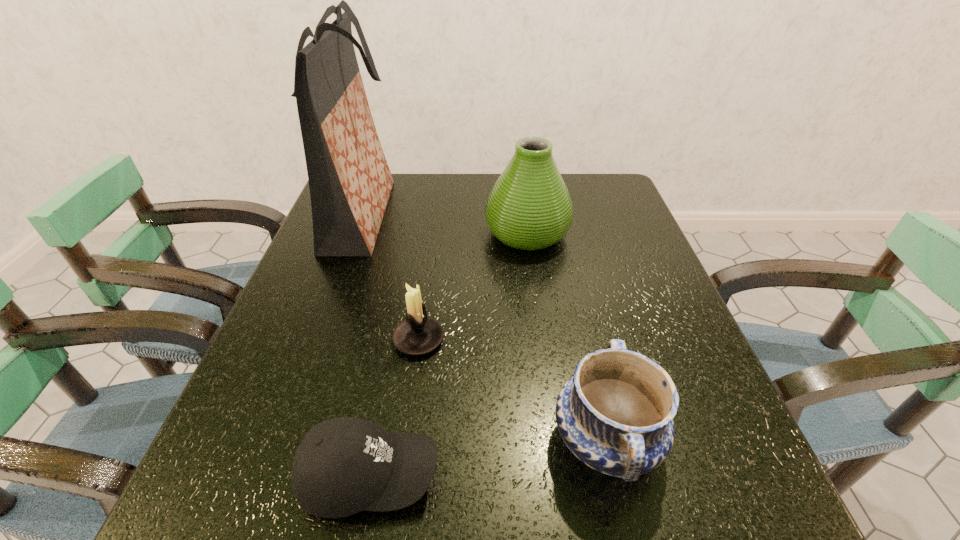
The image size is (960, 540). Find the location of `shopping bag situated at the far edge`. shopping bag situated at the far edge is located at coordinates (350, 182).

In order to click on vase located in the far edge section of the desktop in this screenshot , I will do point(529,207).

This screenshot has height=540, width=960. I want to click on pottery that is at the near edge, so click(615, 414).

In order to click on baseball cap located in the near edge section of the desktop in this screenshot , I will do `click(344, 465)`.

At what (x,y) coordinates should I click in order to perform the action: click on shopping bag that is at the left edge. Please return your answer as a coordinate pair (x, y). Looking at the image, I should click on (350, 182).

This screenshot has width=960, height=540. Identify the location of baseball cap that is at the left edge. (344, 465).

In order to click on object present at the right edge in this screenshot , I will do `click(615, 414)`.

The width and height of the screenshot is (960, 540). I want to click on object that is at the far left corner, so click(x=350, y=182).

At what (x,y) coordinates should I click in order to perform the action: click on object positioned at the near left corner. Please return your answer as a coordinate pair (x, y). Image resolution: width=960 pixels, height=540 pixels. Looking at the image, I should click on (344, 465).

Where is `object that is positioned at the near right corner`? This screenshot has height=540, width=960. object that is positioned at the near right corner is located at coordinates (615, 414).